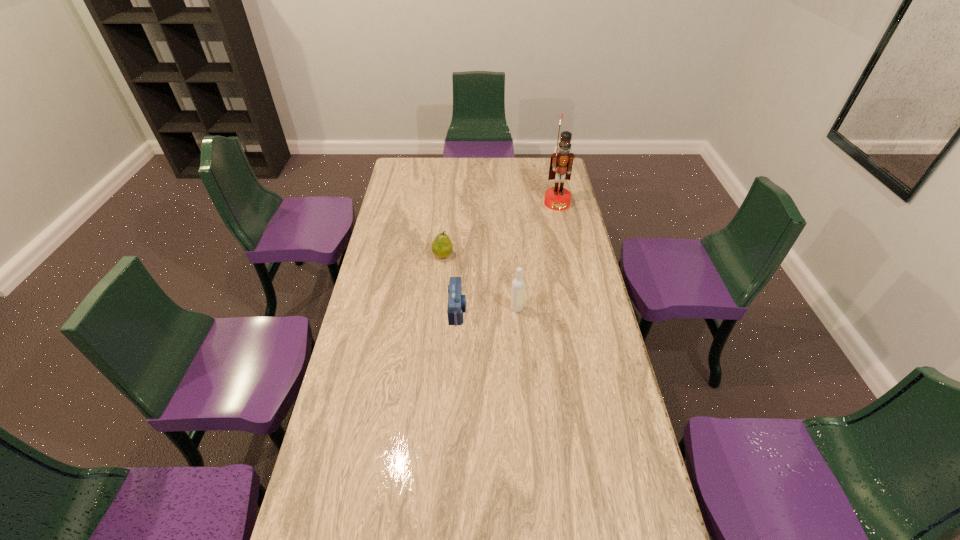
Locate an element on the screen. The height and width of the screenshot is (540, 960). nutcracker is located at coordinates (557, 198).

The width and height of the screenshot is (960, 540). Identify the location of the farthest object. (557, 198).

Image resolution: width=960 pixels, height=540 pixels. Find the location of `the third shortest object`. the third shortest object is located at coordinates (518, 284).

Find the location of a particular element. the third object from left to right is located at coordinates pyautogui.click(x=518, y=284).

Image resolution: width=960 pixels, height=540 pixels. I want to click on the second farthest object, so click(442, 247).

Identify the location of pear. (442, 247).

I want to click on the shortest object, so click(x=456, y=301).

Where is `vacant position located on the front-facing side of the farthest object`? Image resolution: width=960 pixels, height=540 pixels. vacant position located on the front-facing side of the farthest object is located at coordinates (562, 225).

Locate an element on the screen. The width and height of the screenshot is (960, 540). free location located on the back of the third object from left to right is located at coordinates (513, 259).

Locate an element on the screen. This screenshot has height=540, width=960. free spot located on the front of the pear is located at coordinates (439, 296).